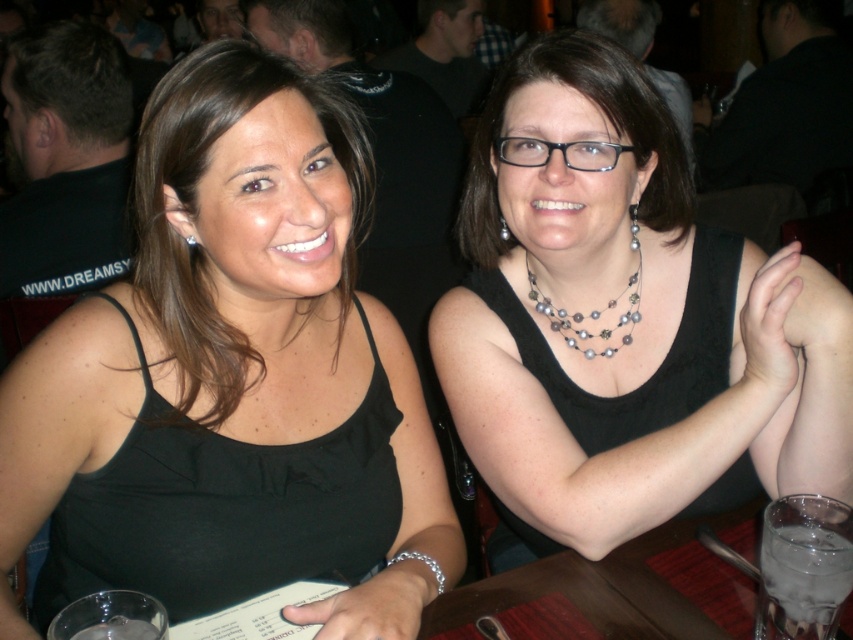
Does black matte tank top at center appear over brown wooden table at lower center?

Yes, black matte tank top at center is above brown wooden table at lower center.

Is black matte tank top at center to the right of brown wooden table at lower center from the viewer's perspective?

In fact, black matte tank top at center is to the left of brown wooden table at lower center.

Which is in front, point (302, 394) or point (750, 556)?

Point (750, 556) is in front.

The height and width of the screenshot is (640, 853). In order to click on black matte tank top at center in this screenshot , I will do `click(231, 380)`.

In the scene shown: Is brown wooden table at lower center to the right of pearl/pearl-like beads necklace at center from the viewer's perspective?

Indeed, brown wooden table at lower center is positioned on the right side of pearl/pearl-like beads necklace at center.

Is point (672, 524) in front of point (575, 337)?

Yes, it is.

You are a GUI agent. You are given a task and a screenshot of the screen. Output one action in this format:
    pyautogui.click(x=<x>, y=<y>)
    Task: Click on the brown wooden table at lower center
    
    Given the screenshot: What is the action you would take?
    pyautogui.click(x=619, y=588)

Between black matte tank top at center and black fabric tank top at center, which one is positioned higher?

Positioned higher is black fabric tank top at center.

Who is lower down, black matte tank top at center or black fabric tank top at center?

black matte tank top at center

I want to click on black matte tank top at center, so click(231, 380).